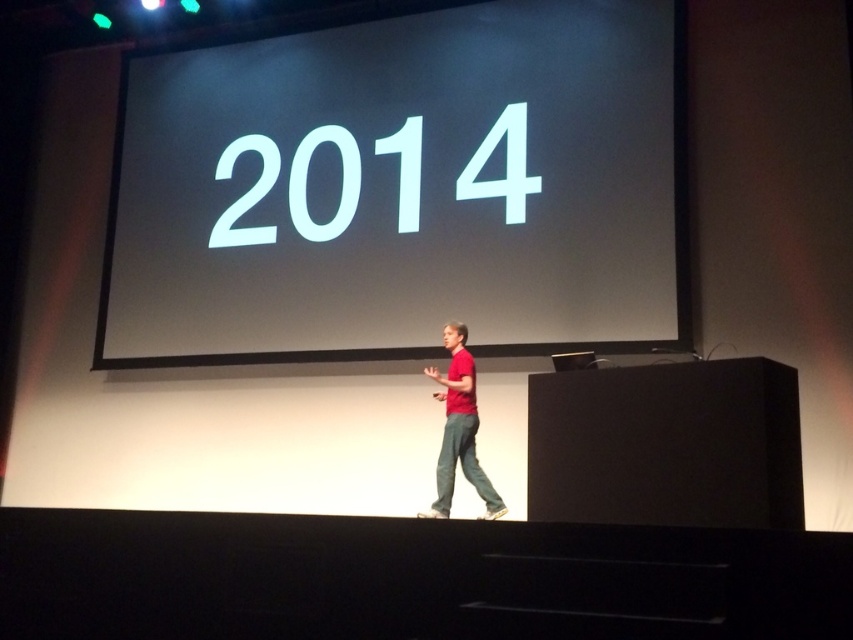
Question: Can you confirm if white glossy projection screen at upper center is positioned to the right of red matte shirt at center?

Choices:
 (A) yes
 (B) no

Answer: (A)

Question: Can you confirm if white glossy projection screen at upper center is bigger than red matte shirt at center?

Choices:
 (A) yes
 (B) no

Answer: (A)

Question: Among these points, which one is farthest from the camera?

Choices:
 (A) (x=306, y=250)
 (B) (x=453, y=472)

Answer: (A)

Question: Is white glossy projection screen at upper center thinner than red matte shirt at center?

Choices:
 (A) no
 (B) yes

Answer: (A)